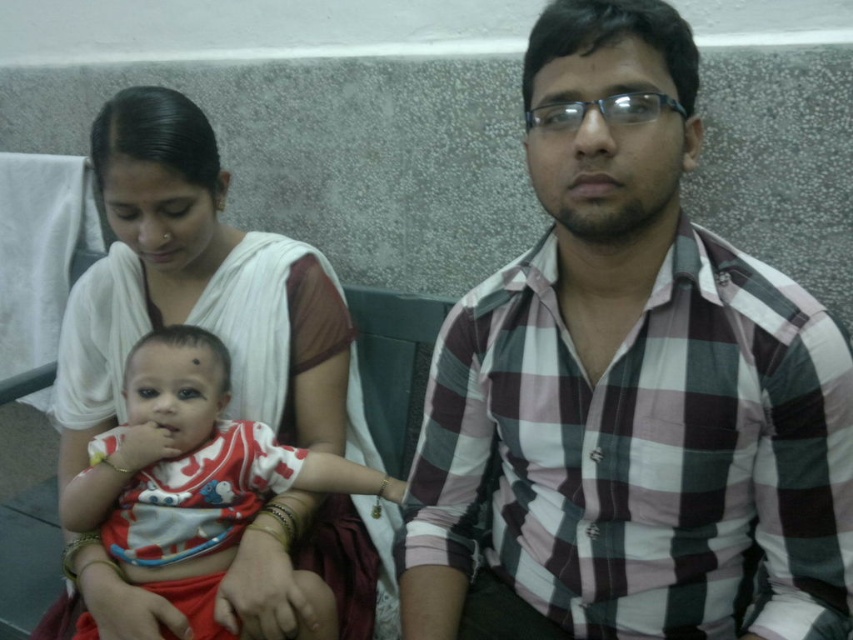
You are standing in front of the scene and want to touch the point at coordinates point (590, 308). Can you reach it without moving your feet?

The point (590, 308) is 35.29 inches away from the viewer, so yes, you can reach it without moving your feet since it is within arm reach.

You are a photographer trying to capture a group photo of the plaid cotton shirt at center and the white cotton shirt at center. Since you want to ensure both shirts are clearly visible, which shirt should you focus on first to account for their sizes?

The plaid cotton shirt at center is bigger than the white cotton shirt at center, so you should focus on the plaid cotton shirt at center first to ensure its details are captured clearly before adjusting for the smaller one.

You are a tailor measuring shirts for alterations. You have two shirts in front of you, the plaid cotton shirt at center and the white cotton shirt at center. Which shirt requires a wider fabric width for alterations?

The white cotton shirt at center requires a wider fabric width for alterations since its width is greater than the plaid cotton shirt at center.